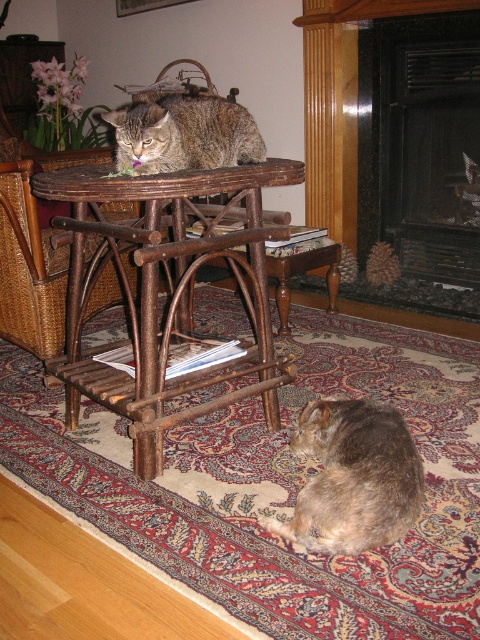
Is point (377, 136) positioned behind point (239, 262)?

Yes.

Who is more forward, (476, 305) or (176, 237)?

Positioned in front is point (176, 237).

Is point (464, 99) positioned in front of point (259, 180)?

No, (464, 99) is behind (259, 180).

At what (x,y) coordinates should I click in order to perform the action: click on black marble fireplace at upper right. Please return your answer as a coordinate pair (x, y). The width and height of the screenshot is (480, 640). Looking at the image, I should click on point(420,156).

Is point (384, 232) closer to viewer compared to point (348, 417)?

No, it is behind (348, 417).

The image size is (480, 640). I want to click on black marble fireplace at upper right, so click(420, 156).

Where is `brown wood table at center`? brown wood table at center is located at coordinates (171, 296).

Describe the element at coordinates (171, 296) in the screenshot. I see `brown wood table at center` at that location.

In order to click on brown wood table at center in this screenshot , I will do `click(171, 296)`.

You are a GUI agent. You are given a task and a screenshot of the screen. Output one action in this format:
    pyautogui.click(x=<x>, y=<y>)
    Task: Click on the brown wood table at center
    The height and width of the screenshot is (640, 480).
    Given the screenshot: What is the action you would take?
    pyautogui.click(x=171, y=296)